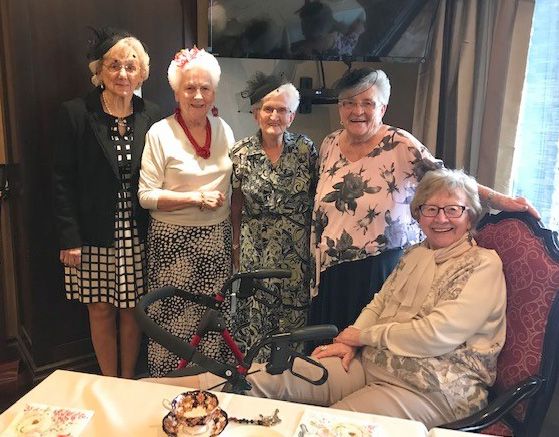
This screenshot has height=437, width=559. In order to click on window in this screenshot , I will do `click(543, 117)`.